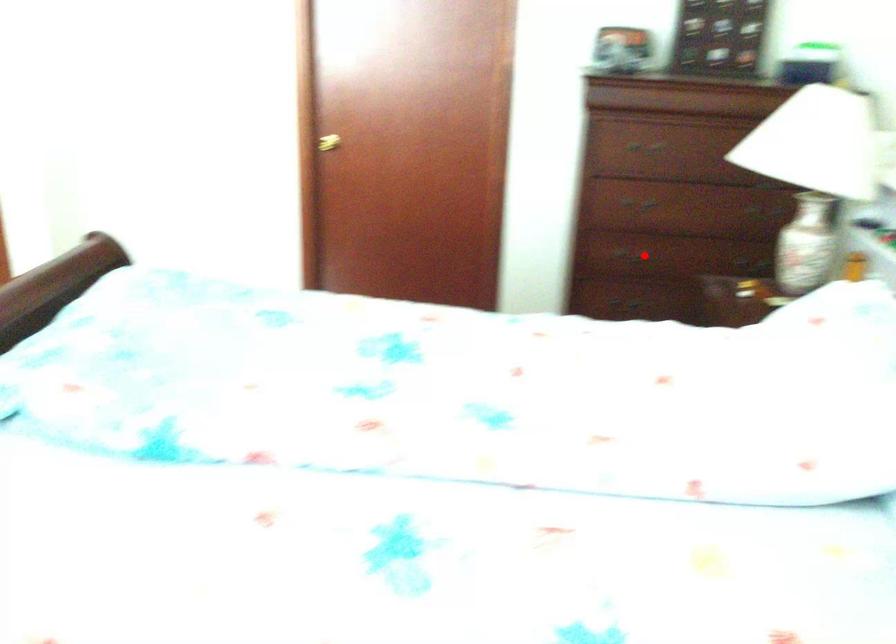
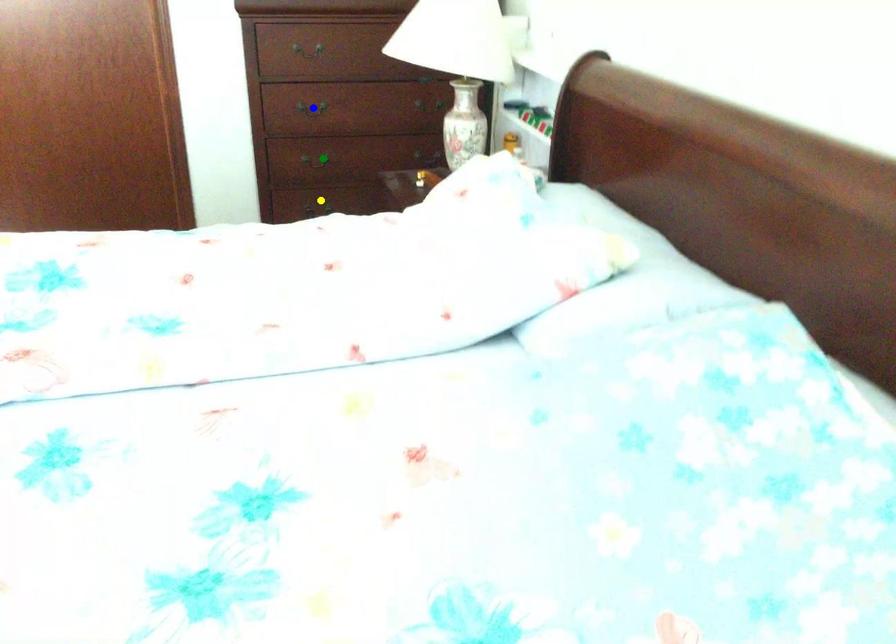
Question: I am providing you with two images of the same scene from different viewpoints. A red point is marked on the first image. You are given multiple points on the second image. Which mark in image 2 goes with the point in image 1?

Choices:
 (A) green point
 (B) yellow point
 (C) blue point

Answer: (A)